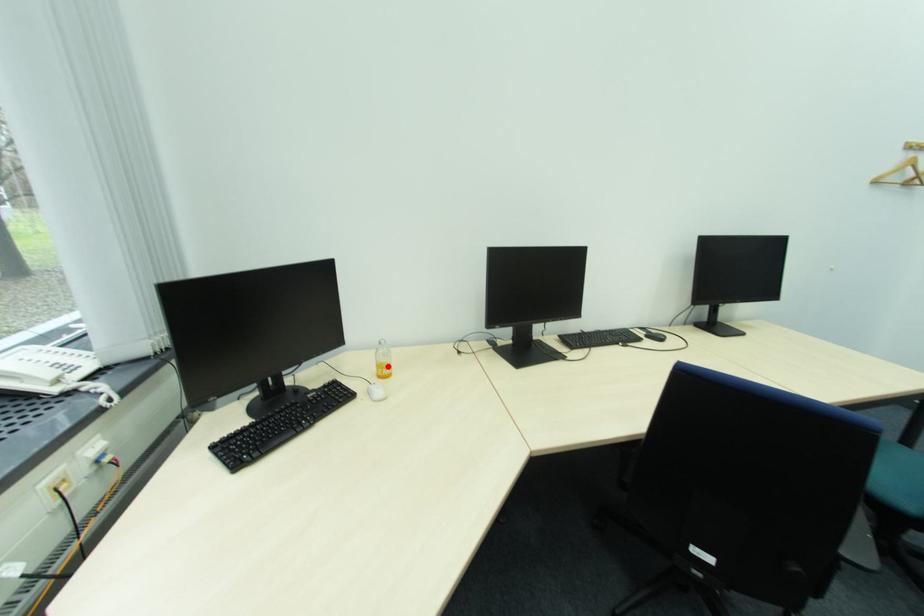
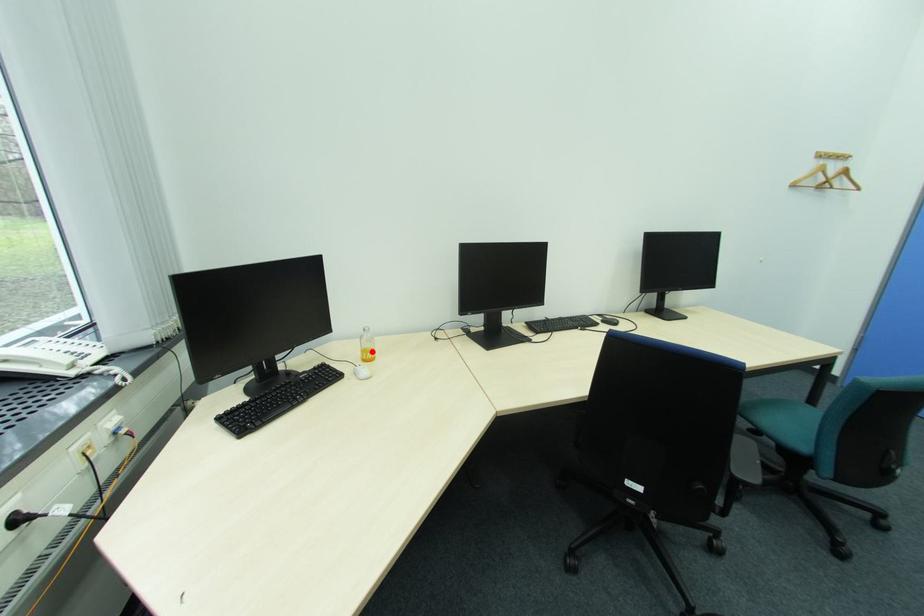
I am providing you with two images of the same scene from different viewpoints. A red point is marked on the first image and another point is marked on the second image. Does the point marked in image1 correspond to the same location as the one in image2?

Yes